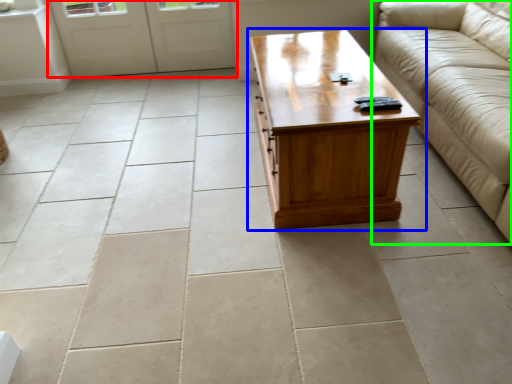
Question: Considering the real-world distances, which object is farthest from door (highlighted by a red box)? coffee table (highlighted by a blue box) or studio couch (highlighted by a green box)?

Choices:
 (A) coffee table
 (B) studio couch

Answer: (B)